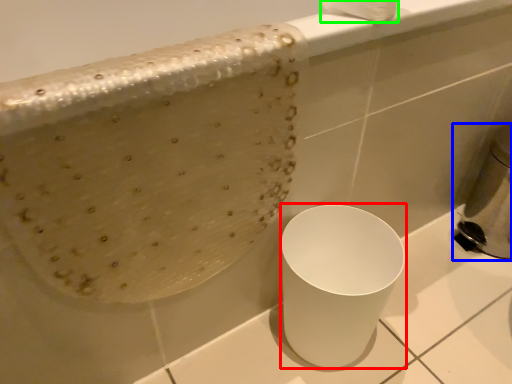
Question: Considering the real-world distances, which object is closest to porcelain (highlighted by a red box)? appliance (highlighted by a blue box) or toilet paper (highlighted by a green box).

Choices:
 (A) appliance
 (B) toilet paper

Answer: (B)